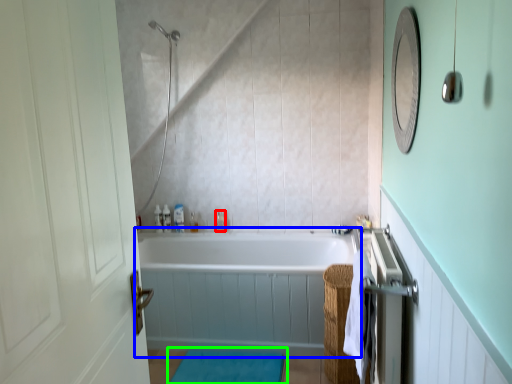
Question: Which is farther away from toiletry (highlighted by a red box)? bathtub (highlighted by a blue box) or bath mat (highlighted by a green box)?

Choices:
 (A) bathtub
 (B) bath mat

Answer: (B)